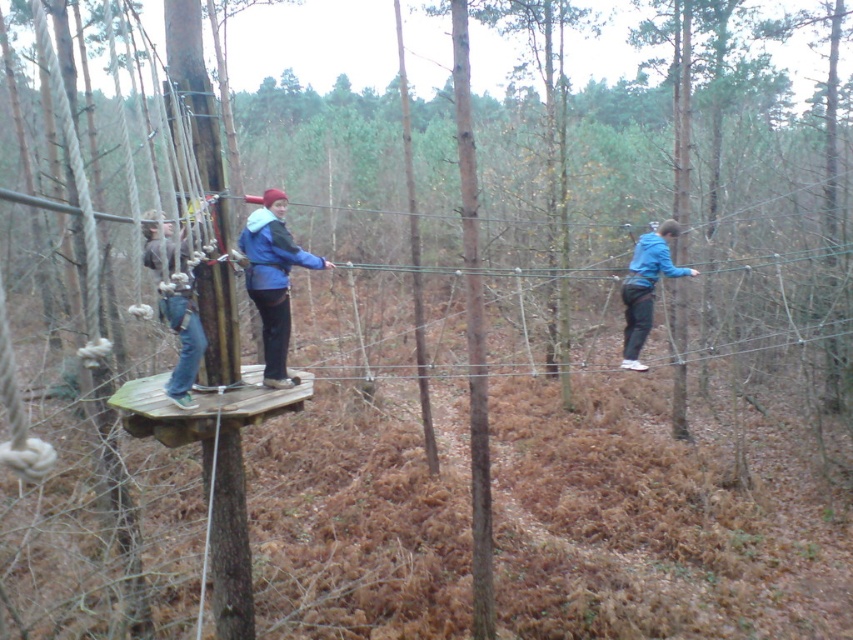
From the picture: You are an observer at the ropes course and notice two participants wearing jackets labeled as blue fleece jacket at center and blue fabric jacket at center. Which jacket is positioned higher in the image?

The blue fleece jacket at center is taller than the blue fabric jacket at center, so the blue fleece jacket at center is positioned higher.

You are navigating a ropes course in the forest and need to move from one platform to another. You see two points marked as point 1 at coordinates point (294, 250) and point 2 at coordinates point (195, 308). Which point should you aim for first if you want to progress forward along the course?

You should aim for point 1 at coordinates point (294, 250) first because it is closer to you than point 2 at coordinates point (195, 308), according to the spatial relationship described.